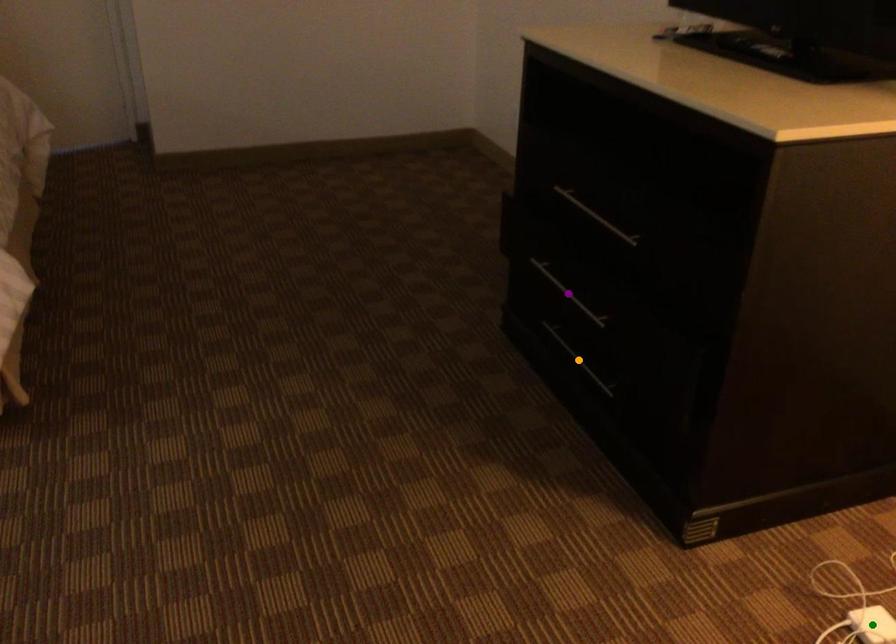
Order these from nearest to farthest:
purple point
green point
orange point

orange point → purple point → green point